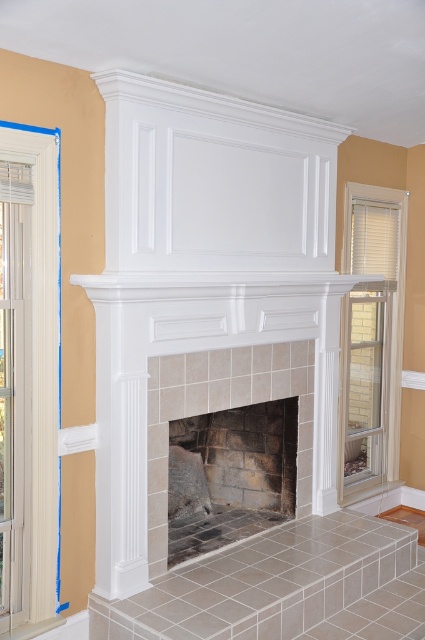
You are standing in the room and want to open the white wood window at right. Based on its position, where should you walk to in order to reach it?

The white wood window at right is located at point (371, 339), so you should walk towards the right side of the fireplace to reach it.

You are decorating the room and need to place a large painting between the white wood window at right and the dark gray stone fireplace at center. Based on their positions, where should you place the painting?

The white wood window at right is to the right of the dark gray stone fireplace at center, so you should place the painting between them on the right side of the fireplace and left side of the window.